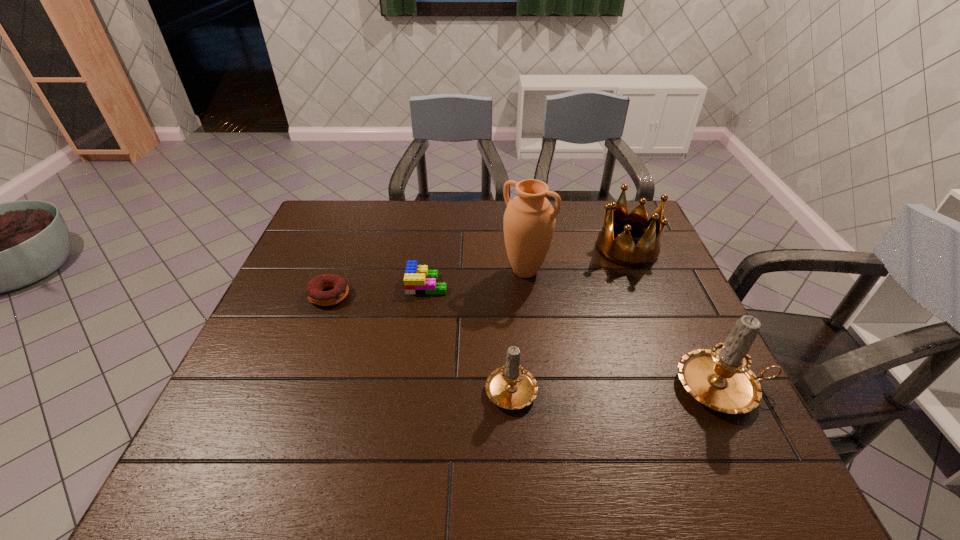
Identify the location of object positioned at the far right corner. This screenshot has width=960, height=540. (621, 251).

In order to click on object present at the near right corner in this screenshot , I will do `click(720, 378)`.

This screenshot has width=960, height=540. I want to click on vacant space at the far edge of the desktop, so click(389, 216).

In the image, there is a desktop. At what (x,y) coordinates should I click in order to perform the action: click on vacant space at the left edge. Please return your answer as a coordinate pair (x, y). Looking at the image, I should click on (303, 291).

In the image, there is a desktop. Identify the location of blank space at the right edge. The image size is (960, 540). (669, 292).

What are the coordinates of `free space at the far left corner of the desktop` in the screenshot? It's located at (359, 211).

Where is `vacant space at the near left corner`? Image resolution: width=960 pixels, height=540 pixels. vacant space at the near left corner is located at coordinates (219, 428).

In the image, there is a desktop. Find the location of `vacant space at the far right corner`. vacant space at the far right corner is located at coordinates (616, 233).

Locate an element on the screen. The image size is (960, 540). empty space that is in between the crown and the urn is located at coordinates (x=576, y=260).

Find the location of a particular element. empty location between the fifth tallest object and the leftmost object is located at coordinates (378, 289).